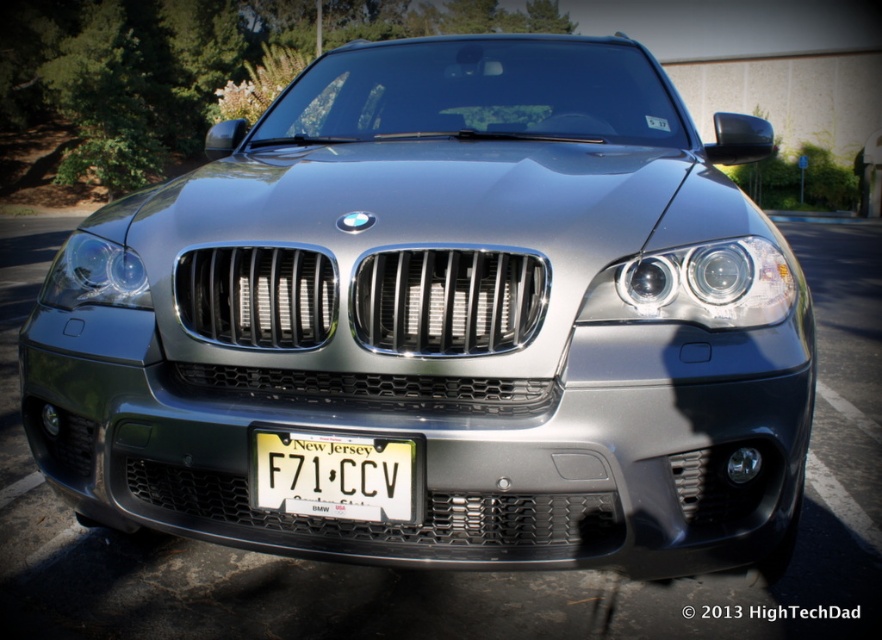
You are standing in front of a BMW X5 parked outside. The license plate is located at point (334, 476). If you want to read the license plate, where should you look relative to the car?

The white plastic license plate at center is represented by point (334, 476), so you should look at the center of the car to read the license plate.

You are a car designer evaluating the front design of a BMW X5. You need to determine if the white plastic license plate at center can fit vertically into the space currently occupied by the satin chrome headlight at center. Based on their sizes, can the license plate be placed there?

The white plastic license plate at center is much taller than the satin chrome headlight at center, so it cannot fit vertically into the headlight area as it would require more vertical space.

You are standing in front of a BMW X5 parked outside. The license plate is located at the center of the car. If you were to touch the point at coordinates (334, 476) on the car, what would you feel?

The point at coordinates (334, 476) corresponds to the white plastic license plate at center, so you would feel a smooth, flat surface made of plastic.